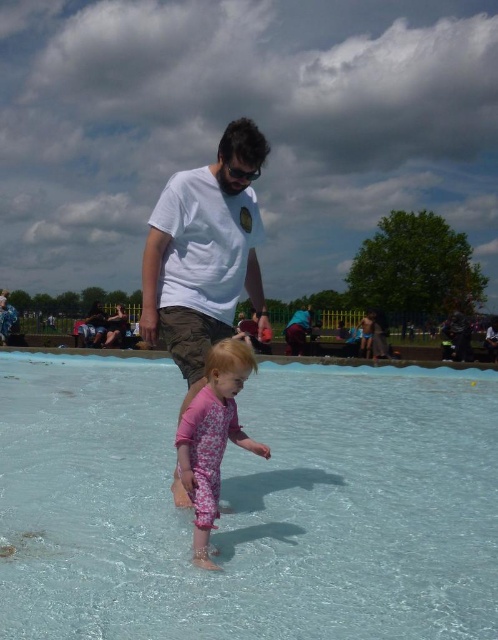
Which of these two, transparent plastic pool at center or pink floral swimsuit at center, stands taller?

pink floral swimsuit at center

Is transparent plastic pool at center shorter than pink floral swimsuit at center?

Correct, transparent plastic pool at center is not as tall as pink floral swimsuit at center.

The image size is (498, 640). In order to click on transparent plastic pool at center in this screenshot , I will do `click(249, 504)`.

Locate an element on the screen. transparent plastic pool at center is located at coordinates (249, 504).

Does white cotton t-shirt at center come behind pink floral swimsuit at center?

That is True.

Is point (166, 340) closer to camera compared to point (230, 381)?

No, it is behind (230, 381).

The image size is (498, 640). What are the coordinates of `white cotton t-shirt at center` in the screenshot? It's located at (204, 253).

Between point (418, 588) and point (289, 353), which one is positioned in front?

Point (418, 588) is more forward.

Find the location of a particular element. The image size is (498, 640). transparent plastic pool at center is located at coordinates (249, 504).